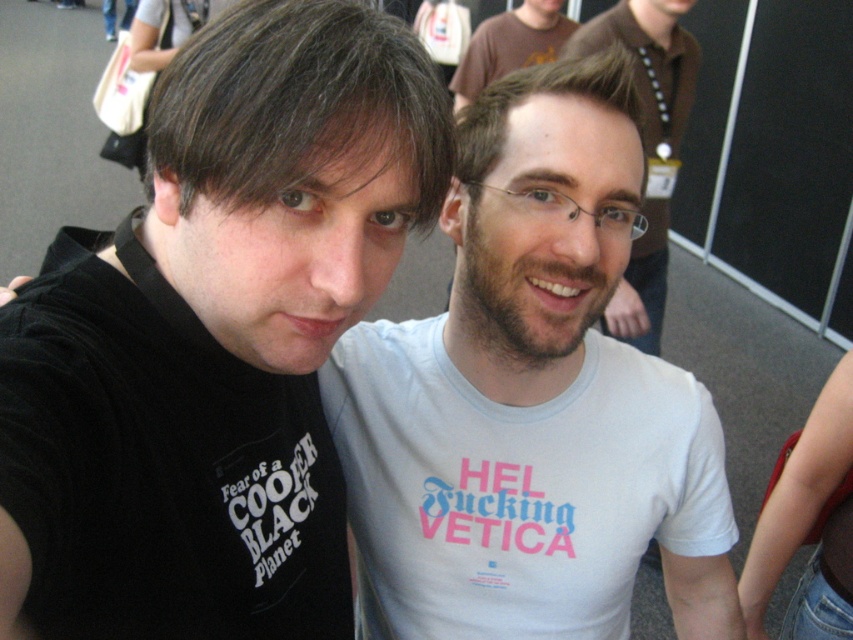
You are standing at the point marked as point (393, 196) and want to take a photo of the two people in the scene. The camera you have can focus on subjects within 20 inches. Will you be able to take a clear photo of them?

The distance between point (393, 196) and the camera is 20.71 inches. Since the camera can focus within 20 inches, the distance is slightly beyond the camera range. Therefore, you might not get a clear photo.

You are a photographer trying to focus on the black matte t shirt at left. The camera is set to focus at point (219, 333). Will the focus be correct?

Yes, the focus will be correct because the point (219, 333) is where the black matte t shirt at left is located.